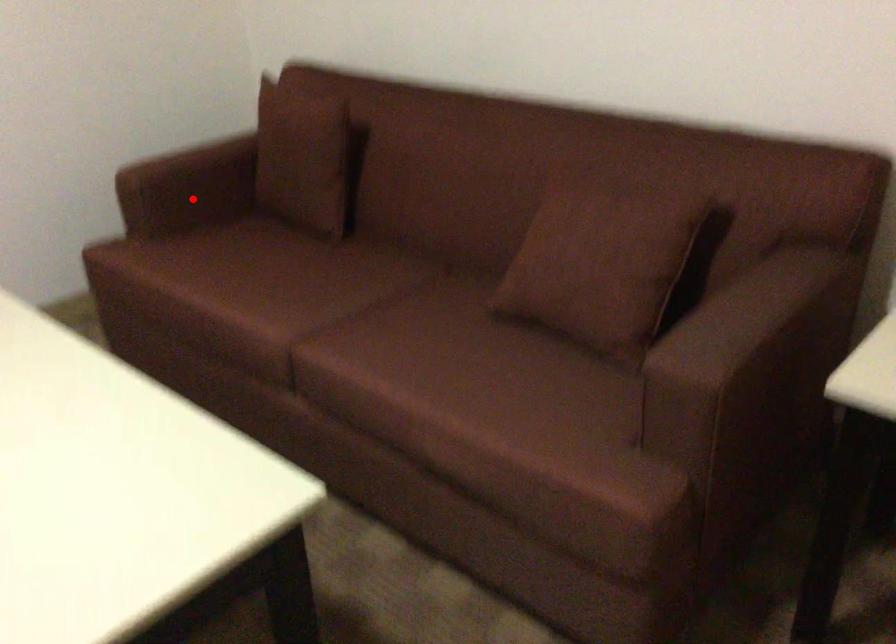
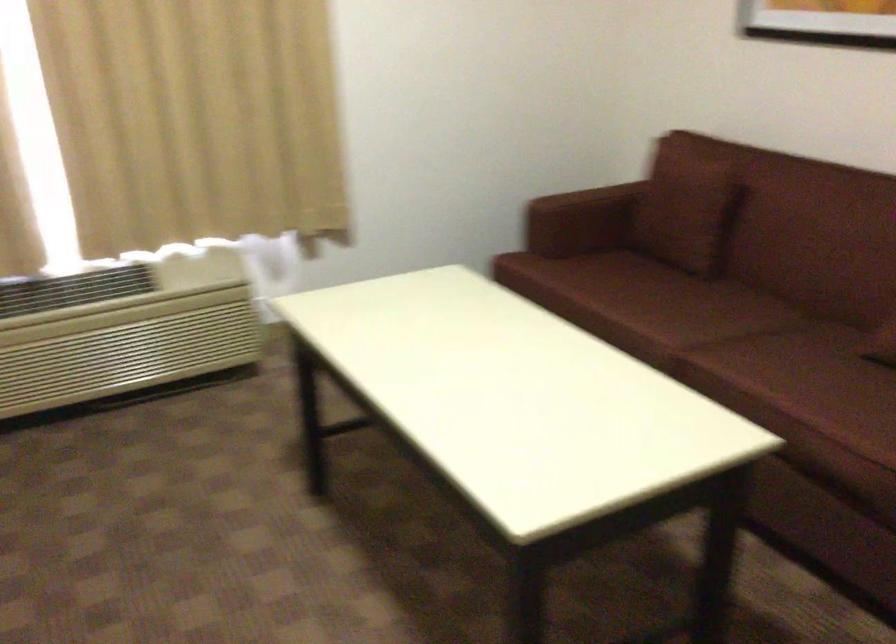
Where in the second image is the point corresponding to the highlighted location from the first image?

(573, 225)